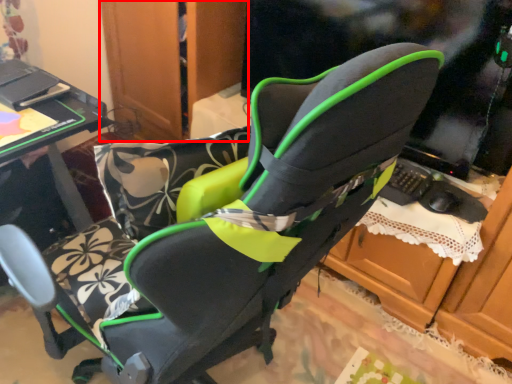
Question: From the image's perspective, where is dresser (annotated by the red box) located relative to table?

Choices:
 (A) below
 (B) above

Answer: (B)